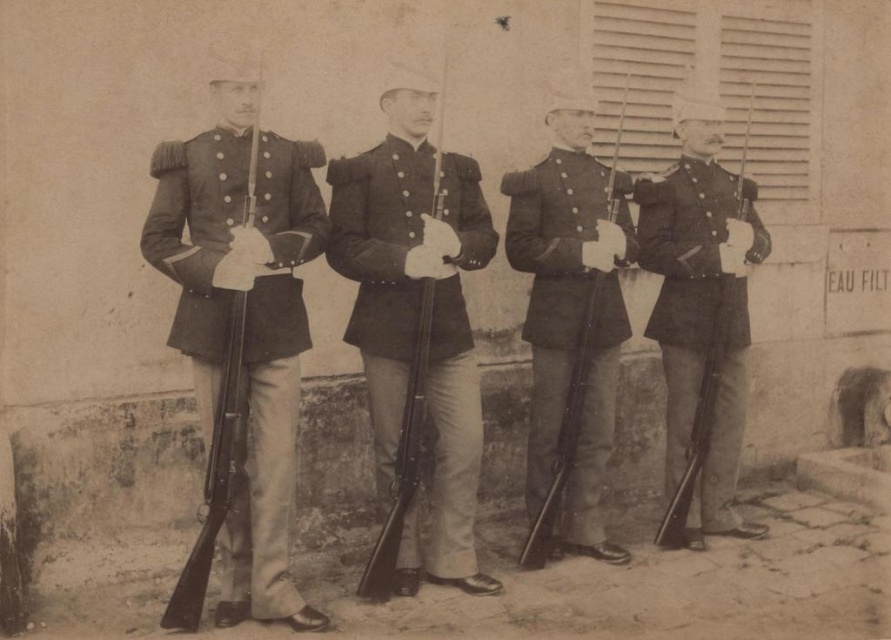
Question: Does matte black rifle at center appear on the right side of dark blue wool jacket at center?

Choices:
 (A) yes
 (B) no

Answer: (B)

Question: Is dark blue wool jacket at center bigger than dark gray wool uniform at center?

Choices:
 (A) yes
 (B) no

Answer: (A)

Question: Which point is farther to the camera?

Choices:
 (A) matte black rifle at center
 (B) matte black uniform at left
 (C) dark blue wool jacket at center
 (D) smooth dark fabric uniform at right

Answer: (D)

Question: Estimate the real-world distances between objects in this image. Which object is farther from the matte black uniform at left?

Choices:
 (A) smooth dark fabric uniform at right
 (B) dark blue wool jacket at center
 (C) matte black rifle at center

Answer: (A)

Question: Which object appears closest to the camera in this image?

Choices:
 (A) dark blue wool jacket at center
 (B) smooth dark fabric uniform at right
 (C) dark gray wool uniform at center

Answer: (A)

Question: Considering the relative positions of matte black uniform at left and dark blue wool jacket at center in the image provided, where is matte black uniform at left located with respect to dark blue wool jacket at center?

Choices:
 (A) above
 (B) below

Answer: (B)